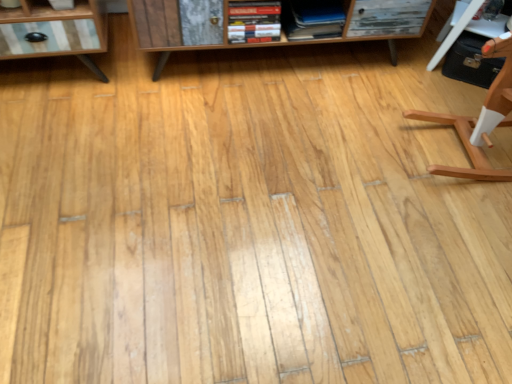
I want to click on vacant space in light brown wood rocking chair at right (from a real-world perspective), so click(x=454, y=153).